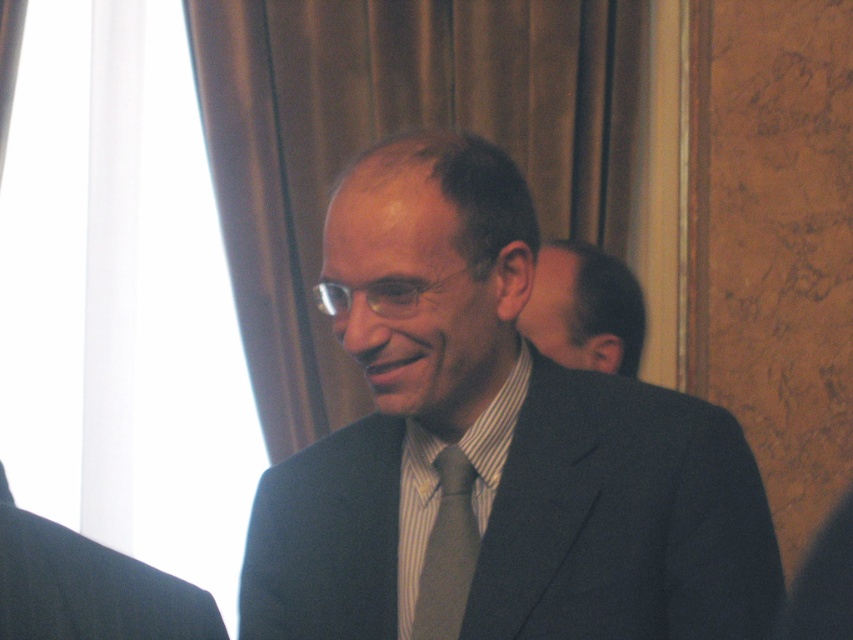
Looking at this image, you are an artist trying to sketch the man in the image. To accurately place his smooth black hair at right, where should you position it in terms of coordinates?

The smooth black hair at right should be positioned at coordinates approximately 0.484 on the x axis and 0.686 on the y axis.

You are a fashion designer observing the man in the image. You need to determine the spatial arrangement of his outfit components. Is the dark gray wool suit at left positioned above or below the smooth black hair at right?

The dark gray wool suit at left is located below smooth black hair at right, so the dark gray wool suit at left is positioned below the smooth black hair at right.